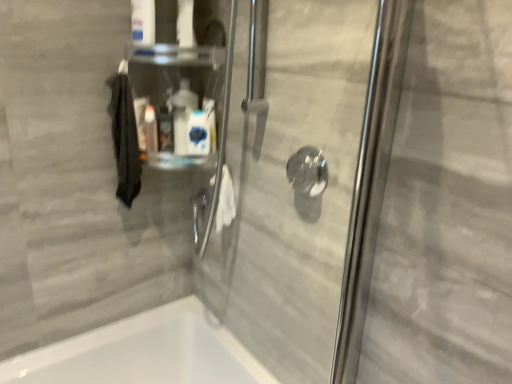
The height and width of the screenshot is (384, 512). What do you see at coordinates (308, 181) in the screenshot?
I see `transparent glass shower handle at center` at bounding box center [308, 181].

Describe the element at coordinates (175, 96) in the screenshot. I see `clear plastic container at upper center` at that location.

Locate an element on the screen. black matte hand towel at left is located at coordinates (124, 139).

The height and width of the screenshot is (384, 512). I want to click on transparent glass shower handle at center, so click(308, 181).

Which is more to the right, white glossy bottle at upper center, which ranks as the first cleaning product in left-to-right order, or transparent glass shower handle at center?

Positioned to the right is transparent glass shower handle at center.

Consider the image. Is white glossy bottle at upper center, placed as the second cleaning product when sorted from right to left, aimed at transparent glass shower handle at center?

No.

Is white glossy bottle at upper center, placed as the second cleaning product when sorted from right to left, taller than transparent glass shower handle at center?

Yes.

Does white glossy bottle at upper center, placed as the second cleaning product when sorted from right to left, have a larger size compared to transparent glass shower handle at center?

Yes, white glossy bottle at upper center, placed as the second cleaning product when sorted from right to left, is bigger than transparent glass shower handle at center.

From the image's perspective, is clear plastic container at upper center under white glossy bottle at upper center, placed as the second cleaning product when sorted from right to left?

Incorrect, from the image's perspective, clear plastic container at upper center is higher than white glossy bottle at upper center, placed as the second cleaning product when sorted from right to left.

From a real-world perspective, between clear plastic container at upper center and white glossy bottle at upper center, placed as the second cleaning product when sorted from right to left, who is vertically higher?

clear plastic container at upper center, from a real-world perspective.

Is clear plastic container at upper center closer to camera compared to white glossy bottle at upper center, placed as the second cleaning product when sorted from right to left?

Yes.

Considering the sizes of objects clear plastic container at upper center and white glossy bottle at upper center, which ranks as the first cleaning product in left-to-right order, in the image provided, who is taller, clear plastic container at upper center or white glossy bottle at upper center, which ranks as the first cleaning product in left-to-right order,?

Standing taller between the two is clear plastic container at upper center.

Is white glossy bottle at center, the first cleaning product when ordered from right to left, far away from transparent glass shower handle at center?

No.

Is white glossy bottle at center, the first cleaning product when ordered from right to left, situated inside transparent glass shower handle at center or outside?

white glossy bottle at center, the first cleaning product when ordered from right to left, is not enclosed by transparent glass shower handle at center.

From the image's perspective, is white glossy bottle at center, which is the second cleaning product from left to right, located above transparent glass shower handle at center?

Yes, from the image's perspective, white glossy bottle at center, which is the second cleaning product from left to right, is on top of transparent glass shower handle at center.

Is transparent glass shower handle at center to the right of white glossy bottle at center, the first cleaning product when ordered from right to left, from the viewer's perspective?

Indeed, transparent glass shower handle at center is positioned on the right side of white glossy bottle at center, the first cleaning product when ordered from right to left.

Could you tell me if transparent glass shower handle at center is facing white glossy bottle at center, the first cleaning product when ordered from right to left?

No, transparent glass shower handle at center is not turned towards white glossy bottle at center, the first cleaning product when ordered from right to left.

Considering the relative sizes of transparent glass shower handle at center and white glossy bottle at center, the first cleaning product when ordered from right to left, in the image provided, is transparent glass shower handle at center shorter than white glossy bottle at center, the first cleaning product when ordered from right to left,?

Yes.

Considering the relative positions of transparent glass shower handle at center and white glossy bottle at center, which is the second cleaning product from left to right, in the image provided, is transparent glass shower handle at center in front of white glossy bottle at center, which is the second cleaning product from left to right,?

Yes, the depth of transparent glass shower handle at center is less than that of white glossy bottle at center, which is the second cleaning product from left to right.

Consider the image. Is clear plastic container at upper center directly adjacent to transparent glass shower handle at center?

No, clear plastic container at upper center is not with transparent glass shower handle at center.

From the image's perspective, between clear plastic container at upper center and transparent glass shower handle at center, which one is located above?

clear plastic container at upper center, from the image's perspective.

Is clear plastic container at upper center wider or thinner than transparent glass shower handle at center?

Considering their sizes, clear plastic container at upper center looks broader than transparent glass shower handle at center.

Is clear plastic container at upper center oriented away from transparent glass shower handle at center?

No, transparent glass shower handle at center is not at the back of clear plastic container at upper center.

Where is `cleaning product behind the white glossy bottle at center, the first cleaning product when ordered from right to left`? Image resolution: width=512 pixels, height=384 pixels. cleaning product behind the white glossy bottle at center, the first cleaning product when ordered from right to left is located at coordinates 182,115.

Considering the sizes of objects white glossy bottle at upper center, placed as the second cleaning product when sorted from right to left, and white glossy bottle at center, the first cleaning product when ordered from right to left, in the image provided, who is taller, white glossy bottle at upper center, placed as the second cleaning product when sorted from right to left, or white glossy bottle at center, the first cleaning product when ordered from right to left,?

white glossy bottle at upper center, placed as the second cleaning product when sorted from right to left.

Is black matte hand towel at left positioned beyond the bounds of transparent glass shower handle at center?

That's correct, black matte hand towel at left is outside of transparent glass shower handle at center.

From a real-world perspective, does black matte hand towel at left stand above transparent glass shower handle at center?

No.

Is black matte hand towel at left bigger than transparent glass shower handle at center?

Yes, black matte hand towel at left is bigger than transparent glass shower handle at center.

In the scene shown: Considering the sizes of black matte hand towel at left and transparent glass shower handle at center in the image, is black matte hand towel at left wider or thinner than transparent glass shower handle at center?

black matte hand towel at left is wider than transparent glass shower handle at center.

Locate an element on the screen. The width and height of the screenshot is (512, 384). shower below the white glossy bottle at upper center, which ranks as the first cleaning product in left-to-right order (from the image's perspective) is located at coordinates (308, 181).

From a real-world perspective, count 1st cleaning products downward from the clear plastic container at upper center and point to it. Please provide its 2D coordinates.

[(182, 115)]

Estimate the real-world distances between objects in this image. Which object is further from white glossy bottle at center, which is the second cleaning product from left to right, clear plastic container at upper center or transparent glass shower handle at center?

transparent glass shower handle at center is positioned further to the anchor white glossy bottle at center, which is the second cleaning product from left to right.

Based on their spatial positions, is white glossy bottle at upper center, placed as the second cleaning product when sorted from right to left, or clear plastic container at upper center further from transparent glass shower handle at center?

Based on the image, clear plastic container at upper center appears to be further to transparent glass shower handle at center.

From the image, which object appears to be farther from white glossy bottle at center, the first cleaning product when ordered from right to left, black matte hand towel at left or white glossy bottle at upper center, which ranks as the first cleaning product in left-to-right order?

Among the two, black matte hand towel at left is located further to white glossy bottle at center, the first cleaning product when ordered from right to left.

Looking at the image, which one is located closer to transparent glass shower handle at center, black matte hand towel at left or clear plastic container at upper center?

The object closer to transparent glass shower handle at center is clear plastic container at upper center.

Looking at the image, which one is located closer to clear plastic container at upper center, black matte hand towel at left or white glossy bottle at upper center, placed as the second cleaning product when sorted from right to left?

Based on the image, white glossy bottle at upper center, placed as the second cleaning product when sorted from right to left, appears to be nearer to clear plastic container at upper center.

When comparing their distances from transparent glass shower handle at center, does black matte hand towel at left or white glossy bottle at upper center, which ranks as the first cleaning product in left-to-right order, seem closer?

Based on the image, white glossy bottle at upper center, which ranks as the first cleaning product in left-to-right order, appears to be nearer to transparent glass shower handle at center.

Looking at the image, which one is located further to black matte hand towel at left, white glossy bottle at upper center, placed as the second cleaning product when sorted from right to left, or clear plastic container at upper center?

Based on the image, white glossy bottle at upper center, placed as the second cleaning product when sorted from right to left, appears to be further to black matte hand towel at left.

From the image, which object appears to be nearer to clear plastic container at upper center, white glossy bottle at upper center, placed as the second cleaning product when sorted from right to left, or white glossy bottle at center, the first cleaning product when ordered from right to left?

white glossy bottle at upper center, placed as the second cleaning product when sorted from right to left, lies closer to clear plastic container at upper center than the other object.

Where is `shelf situated between black matte hand towel at left and white glossy bottle at upper center, placed as the second cleaning product when sorted from right to left, from left to right`? shelf situated between black matte hand towel at left and white glossy bottle at upper center, placed as the second cleaning product when sorted from right to left, from left to right is located at coordinates (175, 96).

Locate an element on the screen. The width and height of the screenshot is (512, 384). cleaning product between white glossy bottle at upper center, placed as the second cleaning product when sorted from right to left, and transparent glass shower handle at center, in the horizontal direction is located at coordinates (198, 133).

This screenshot has width=512, height=384. What are the coordinates of `cleaning product between black matte hand towel at left and white glossy bottle at center, the first cleaning product when ordered from right to left` in the screenshot? It's located at (182, 115).

Find the location of a particular element. This screenshot has height=384, width=512. shelf situated between black matte hand towel at left and white glossy bottle at center, which is the second cleaning product from left to right, from left to right is located at coordinates (175, 96).